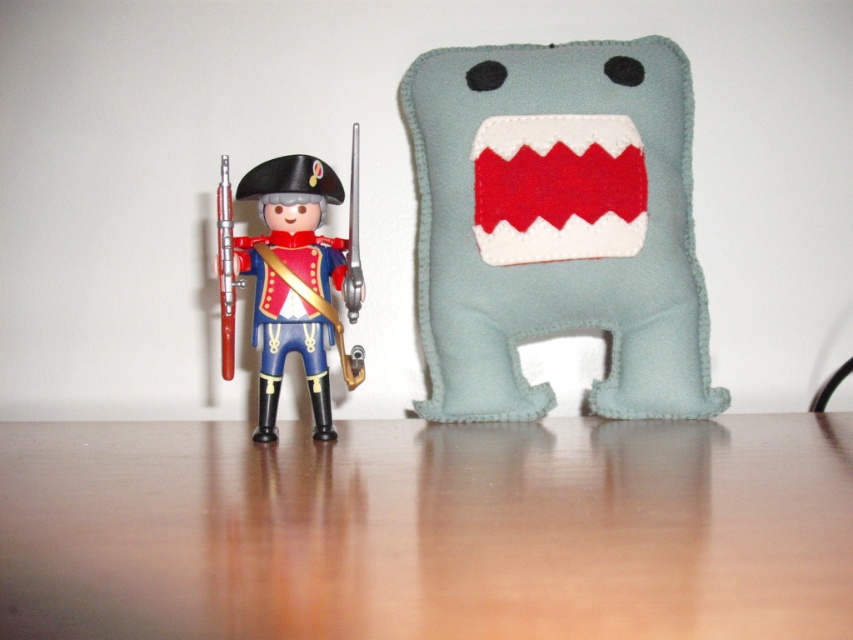
Question: Where is light blue felt plush at right located in relation to shiny plastic soldier at left in the image?

Choices:
 (A) right
 (B) left

Answer: (A)

Question: Among these points, which one is nearest to the camera?

Choices:
 (A) (267, 596)
 (B) (334, 339)
 (C) (268, 406)

Answer: (A)

Question: Does wooden table at center appear over shiny plastic soldier at left?

Choices:
 (A) no
 (B) yes

Answer: (A)

Question: Which point is farther from the camera taking this photo?

Choices:
 (A) (253, 330)
 (B) (432, 324)

Answer: (B)

Question: Which of the following is the closest to the observer?

Choices:
 (A) shiny plastic soldier at left
 (B) light blue felt plush at right

Answer: (A)

Question: Does shiny plastic soldier at left have a lesser width compared to shiny blue fabric uniform at left?

Choices:
 (A) no
 (B) yes

Answer: (A)